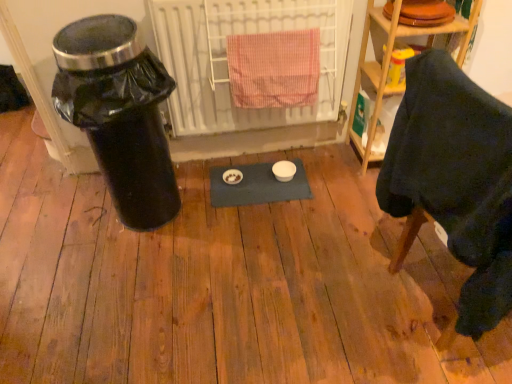
Image resolution: width=512 pixels, height=384 pixels. In order to click on vacant space to the right of black plastic trash can at left in this screenshot , I will do `click(226, 206)`.